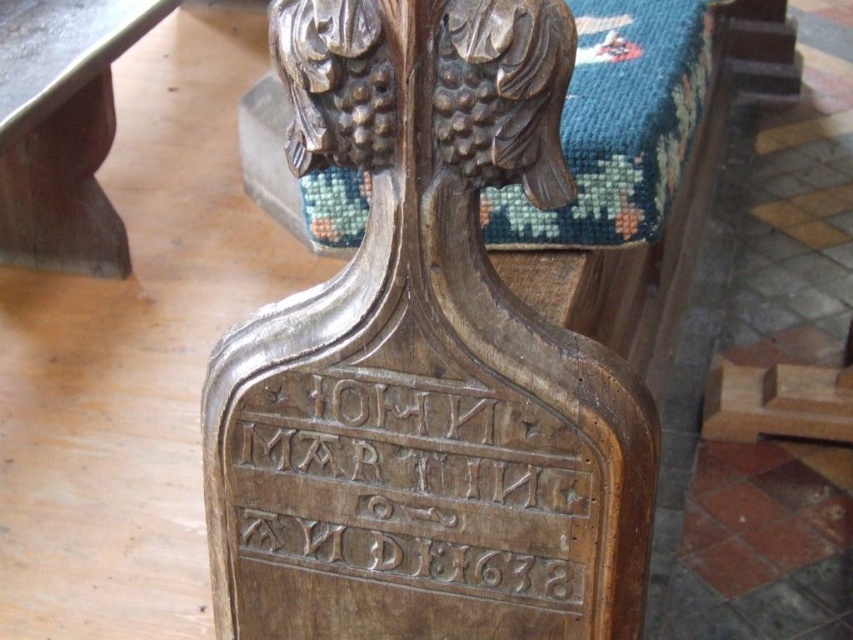
Question: Which point is closer to the camera?

Choices:
 (A) (120, 12)
 (B) (491, 6)

Answer: (B)

Question: Does dark brown wood eagle at upper center appear over wooden table at left?

Choices:
 (A) no
 (B) yes

Answer: (A)

Question: Which object is closer to the camera taking this photo?

Choices:
 (A) wooden table at left
 (B) dark brown wood eagle at upper center

Answer: (B)

Question: Does dark brown wood eagle at upper center lie behind wooden table at left?

Choices:
 (A) yes
 (B) no

Answer: (B)

Question: Does dark brown wood eagle at upper center appear on the left side of wooden table at left?

Choices:
 (A) yes
 (B) no

Answer: (B)

Question: Among these points, which one is farthest from the camera?

Choices:
 (A) (62, 93)
 (B) (334, 125)

Answer: (A)